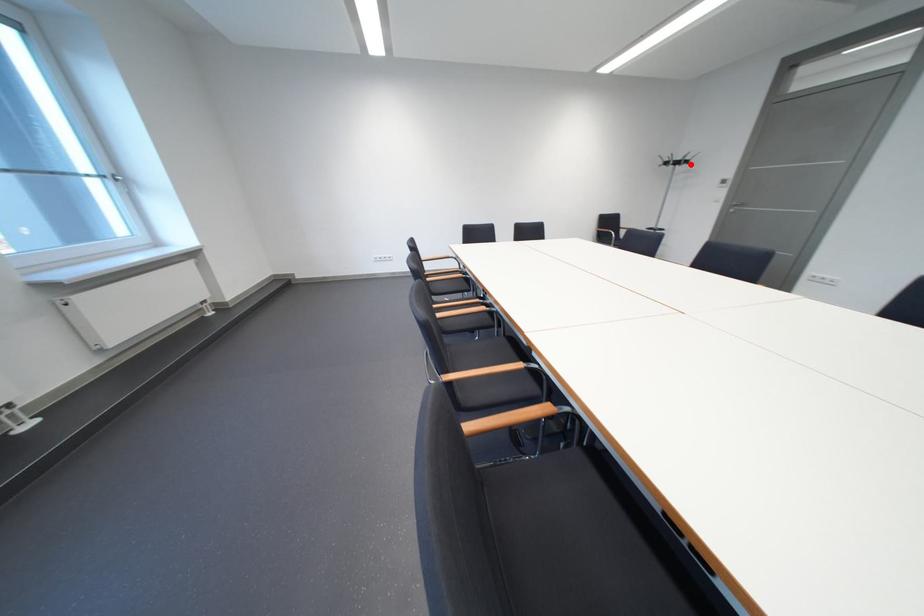
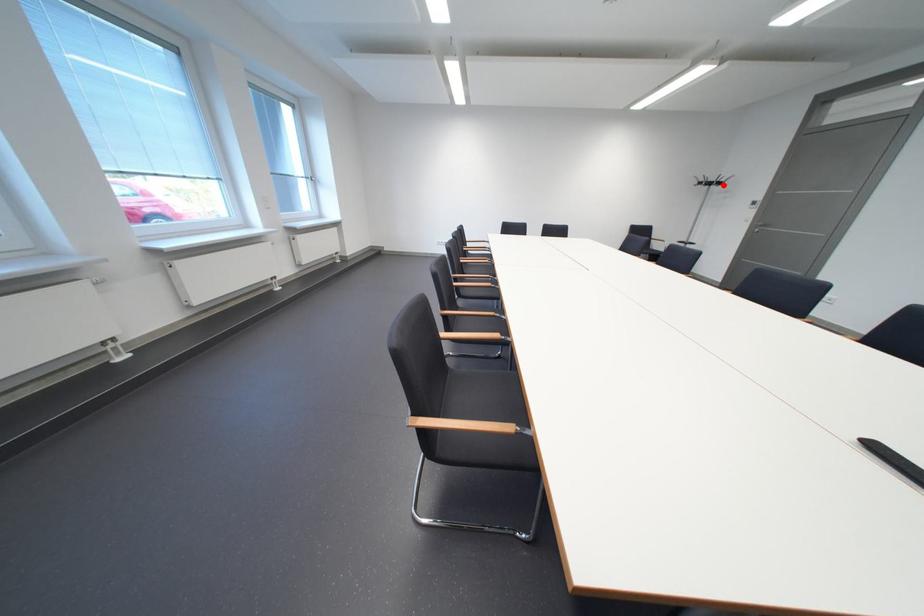
I am providing you with two images of the same scene from different viewpoints. A red point is marked on the first image and another point is marked on the second image. Is the marked point in image1 the same physical position as the marked point in image2?

Yes